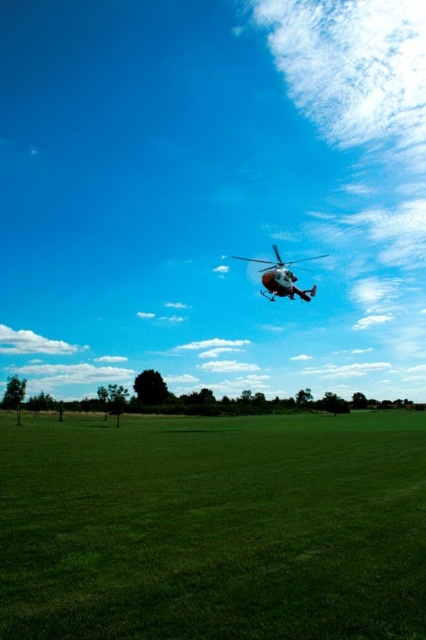
Between green grass at center and white matte helicopter at upper center, which one has more height?

With more height is white matte helicopter at upper center.

Between green grass at center and white matte helicopter at upper center, which one is positioned lower?

green grass at center is below.

What do you see at coordinates (213, 528) in the screenshot?
I see `green grass at center` at bounding box center [213, 528].

You are a GUI agent. You are given a task and a screenshot of the screen. Output one action in this format:
    pyautogui.click(x=<x>, y=<y>)
    Task: Click on the green grass at center
    Image resolution: width=426 pixels, height=640 pixels.
    Given the screenshot: What is the action you would take?
    pyautogui.click(x=213, y=528)